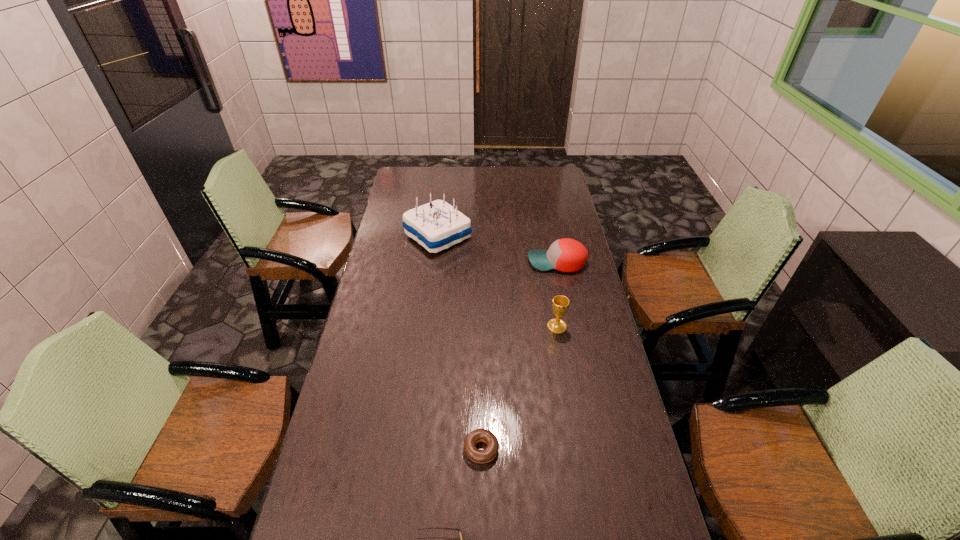
At what (x,y) coordinates should I click in order to perform the action: click on free space in the image that satisfies the following two spatial constraints: 1. on the back side of the fourth tallest object; 2. on the left side of the third farthest object. Please return your answer as a coordinate pair (x, y). Looking at the image, I should click on (481, 327).